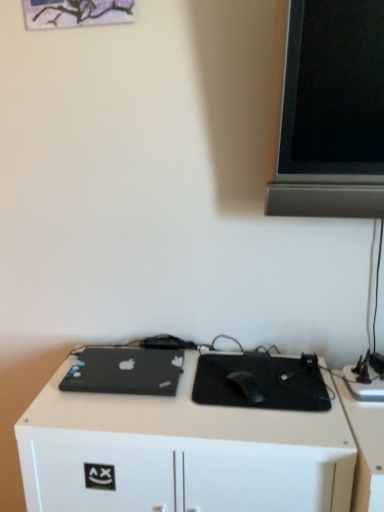
Where is `vacant space situated above black matte laptop at lower left (from a real-world perspective)`? vacant space situated above black matte laptop at lower left (from a real-world perspective) is located at coordinates (126, 366).